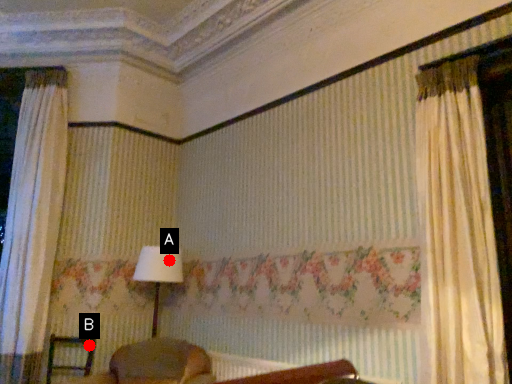
Question: Two points are circled on the image, labeled by A and B beside each circle. Which point is closer to the camera?

Choices:
 (A) A is closer
 (B) B is closer

Answer: (B)